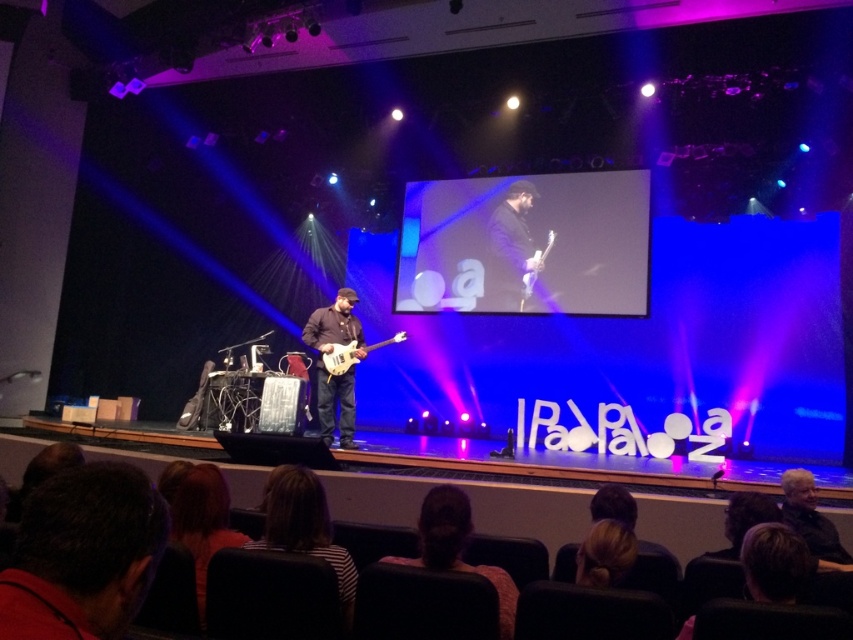
Which is below, shiny black guitar at center or glossy white electric guitar at upper center?

shiny black guitar at center is lower down.

Consider the image. Does shiny black guitar at center appear under glossy white electric guitar at upper center?

Correct, shiny black guitar at center is located below glossy white electric guitar at upper center.

Is point (317, 317) behind point (535, 260)?

No.

Image resolution: width=853 pixels, height=640 pixels. I want to click on shiny black guitar at center, so click(x=328, y=371).

Does black matte guitar at center have a larger size compared to glossy white electric guitar at upper center?

Yes, black matte guitar at center is bigger than glossy white electric guitar at upper center.

Who is taller, black matte guitar at center or glossy white electric guitar at upper center?

With more height is black matte guitar at center.

This screenshot has width=853, height=640. What are the coordinates of `black matte guitar at center` in the screenshot? It's located at (511, 250).

Between dark brown hair at lower center and shiny black guitar at center, which one has more height?

shiny black guitar at center is taller.

Between dark brown hair at lower center and shiny black guitar at center, which one has less height?

Standing shorter between the two is dark brown hair at lower center.

Between point (461, 513) and point (343, 336), which one is positioned behind?

Point (343, 336)

What are the coordinates of `dark brown hair at lower center` in the screenshot? It's located at (456, 547).